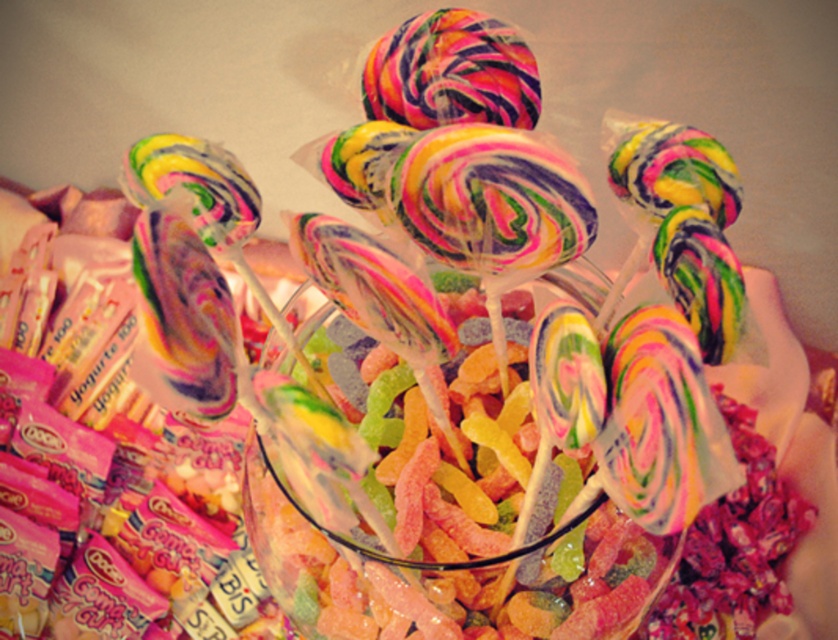
Which of these two, transparent glass bowl at center or rainbow swirl lollipop at center, stands shorter?

rainbow swirl lollipop at center is shorter.

The height and width of the screenshot is (640, 838). What do you see at coordinates (453, 508) in the screenshot? I see `transparent glass bowl at center` at bounding box center [453, 508].

You are a GUI agent. You are given a task and a screenshot of the screen. Output one action in this format:
    pyautogui.click(x=<x>, y=<y>)
    Task: Click on the transparent glass bowl at center
    
    Given the screenshot: What is the action you would take?
    tap(453, 508)

In order to click on transparent glass bowl at center in this screenshot , I will do `click(453, 508)`.